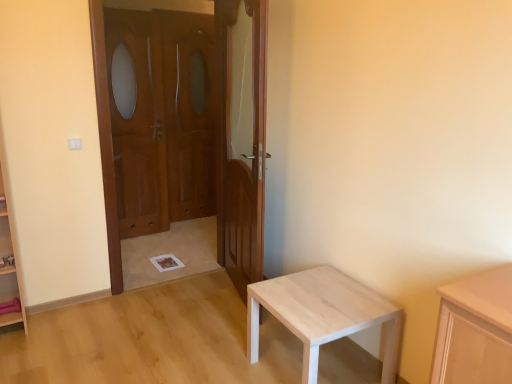
Where is `wooden screen door at center, the 1th screen door in the left-to-right sequence`? The height and width of the screenshot is (384, 512). wooden screen door at center, the 1th screen door in the left-to-right sequence is located at coordinates (136, 123).

What do you see at coordinates (323, 314) in the screenshot? The width and height of the screenshot is (512, 384). I see `light wood table at lower right` at bounding box center [323, 314].

You are a GUI agent. You are given a task and a screenshot of the screen. Output one action in this format:
    pyautogui.click(x=<x>, y=<y>)
    Task: Click on the wooden screen door at center, the 1th screen door in the left-to-right sequence
    
    Given the screenshot: What is the action you would take?
    pyautogui.click(x=136, y=123)

Looking at this image, is wooden screen door at center, the 1th screen door in the left-to-right sequence, surrounding wooden screen door at center, the 1th screen door in the right-to-left sequence?

No.

Based on the photo, can you confirm if wooden screen door at center, the 1th screen door in the left-to-right sequence, is wider than wooden screen door at center, the second screen door positioned from the left?

Yes.

Is wooden screen door at center, the 1th screen door in the left-to-right sequence, far from wooden screen door at center, the second screen door positioned from the left?

No, wooden screen door at center, the 1th screen door in the left-to-right sequence, is not far from wooden screen door at center, the second screen door positioned from the left.

Is wooden screen door at center, which is the second screen door from right to left, closer to the viewer compared to wooden screen door at center, the second screen door positioned from the left?

That is True.

Is wooden door at left, which ranks as the first door in left-to-right order, turned away from wooden screen door at center, the 1th screen door in the left-to-right sequence?

Yes.

In the scene shown: Which object is thinner, wooden door at left, placed as the second door when sorted from right to left, or wooden screen door at center, which is the second screen door from right to left?

Thinner between the two is wooden screen door at center, which is the second screen door from right to left.

From the image's perspective, is wooden door at left, which ranks as the first door in left-to-right order, under wooden screen door at center, which is the second screen door from right to left?

Yes.

Which point is more distant from viewer, (229,212) or (127,194)?

The point (127,194) is farther from the camera.

Find the location of a particular element. Image resolution: width=512 pixels, height=384 pixels. table below the wooden screen door at center, the 1th screen door in the left-to-right sequence (from a real-world perspective) is located at coordinates (323, 314).

Which is less distant, (140, 112) or (318, 293)?

The point (318, 293) is closer to the camera.

Is light wood table at lower right a part of wooden screen door at center, which is the second screen door from right to left?

No, light wood table at lower right is not inside wooden screen door at center, which is the second screen door from right to left.

From the image's perspective, is wooden screen door at center, the 1th screen door in the left-to-right sequence, positioned above or below light wood table at lower right?

wooden screen door at center, the 1th screen door in the left-to-right sequence, is above light wood table at lower right.

Does light wood table at lower right have a greater width compared to wooden screen door at center, the second screen door positioned from the left?

Correct, the width of light wood table at lower right exceeds that of wooden screen door at center, the second screen door positioned from the left.

Measure the distance from light wood table at lower right to wooden screen door at center, the second screen door positioned from the left.

The distance of light wood table at lower right from wooden screen door at center, the second screen door positioned from the left, is 2.55 meters.

Is light wood table at lower right closer to camera compared to wooden screen door at center, the second screen door positioned from the left?

Yes, it is.

From a real-world perspective, is light wood table at lower right below wooden screen door at center, the 1th screen door in the right-to-left sequence?

Yes, from a real-world perspective, light wood table at lower right is below wooden screen door at center, the 1th screen door in the right-to-left sequence.

Does wooden at center, placed as the 2th door when sorted from left to right, have a larger size compared to wooden door at left, placed as the second door when sorted from right to left?

Yes, wooden at center, placed as the 2th door when sorted from left to right, is bigger than wooden door at left, placed as the second door when sorted from right to left.

Would you say wooden at center, which is the 1th door in right-to-left order, is to the left or to the right of wooden door at left, placed as the second door when sorted from right to left, in the picture?

Clearly, wooden at center, which is the 1th door in right-to-left order, is on the right of wooden door at left, placed as the second door when sorted from right to left, in the image.

Is wooden at center, which is the 1th door in right-to-left order, not near wooden door at left, placed as the second door when sorted from right to left?

Yes.

Which is farther from the camera, (147, 180) or (236, 240)?

The point (147, 180) is behind.

I want to click on the 1st screen door behind when counting from the wooden door at left, placed as the second door when sorted from right to left, so click(x=136, y=123).

From the image's perspective, is wooden screen door at center, the 1th screen door in the left-to-right sequence, located beneath wooden door at left, which ranks as the first door in left-to-right order?

Incorrect, from the image's perspective, wooden screen door at center, the 1th screen door in the left-to-right sequence, is higher than wooden door at left, which ranks as the first door in left-to-right order.

Which is more to the right, wooden screen door at center, which is the second screen door from right to left, or wooden door at left, placed as the second door when sorted from right to left?

From the viewer's perspective, wooden door at left, placed as the second door when sorted from right to left, appears more on the right side.

Based on the photo, is wooden door at left, placed as the second door when sorted from right to left, to the right of light wood table at lower right from the viewer's perspective?

In fact, wooden door at left, placed as the second door when sorted from right to left, is to the left of light wood table at lower right.

Which is less distant, (210, 192) or (249, 328)?

Point (210, 192).

Would you consider wooden door at left, which ranks as the first door in left-to-right order, to be distant from light wood table at lower right?

Yes, wooden door at left, which ranks as the first door in left-to-right order, is far from light wood table at lower right.

Considering the sizes of wooden door at left, which ranks as the first door in left-to-right order, and light wood table at lower right in the image, is wooden door at left, which ranks as the first door in left-to-right order, taller or shorter than light wood table at lower right?

Clearly, wooden door at left, which ranks as the first door in left-to-right order, is taller compared to light wood table at lower right.

This screenshot has height=384, width=512. In order to click on screen door located above the wooden screen door at center, the 1th screen door in the left-to-right sequence (from the image's perspective) in this screenshot , I will do `click(189, 112)`.

Locate an element on the screen. This screenshot has width=512, height=384. the 1st door in front of the wooden screen door at center, the 1th screen door in the left-to-right sequence, counting from the anchor's position is located at coordinates (230, 144).

Which object lies further to the anchor point light wood table at lower right, wooden door at left, placed as the second door when sorted from right to left, or wooden screen door at center, the second screen door positioned from the left?

wooden screen door at center, the second screen door positioned from the left, is positioned further to the anchor light wood table at lower right.

When comparing their distances from wooden at center, which is the 1th door in right-to-left order, does light wood table at lower right or wooden door at left, placed as the second door when sorted from right to left, seem closer?

light wood table at lower right is positioned closer to the anchor wooden at center, which is the 1th door in right-to-left order.

Estimate the real-world distances between objects in this image. Which object is closer to light wood table at lower right, wooden at center, placed as the 2th door when sorted from left to right, or wooden door at left, placed as the second door when sorted from right to left?

Among the two, wooden at center, placed as the 2th door when sorted from left to right, is located nearer to light wood table at lower right.

Which object lies nearer to the anchor point light wood table at lower right, wooden screen door at center, which is the second screen door from right to left, or wooden screen door at center, the 1th screen door in the right-to-left sequence?

wooden screen door at center, which is the second screen door from right to left, is positioned closer to the anchor light wood table at lower right.

Based on their spatial positions, is wooden screen door at center, the 1th screen door in the right-to-left sequence, or wooden door at left, placed as the second door when sorted from right to left, closer to light wood table at lower right?

wooden door at left, placed as the second door when sorted from right to left, is positioned closer to the anchor light wood table at lower right.

Which object lies nearer to the anchor point wooden screen door at center, the 1th screen door in the right-to-left sequence, wooden screen door at center, the 1th screen door in the left-to-right sequence, or light wood table at lower right?

Among the two, wooden screen door at center, the 1th screen door in the left-to-right sequence, is located nearer to wooden screen door at center, the 1th screen door in the right-to-left sequence.

Looking at the image, which one is located closer to wooden screen door at center, which is the second screen door from right to left, wooden screen door at center, the second screen door positioned from the left, or wooden door at left, which ranks as the first door in left-to-right order?

wooden door at left, which ranks as the first door in left-to-right order.

Based on their spatial positions, is wooden door at left, placed as the second door when sorted from right to left, or wooden at center, placed as the 2th door when sorted from left to right, closer to light wood table at lower right?

wooden at center, placed as the 2th door when sorted from left to right.

What are the coordinates of `door between wooden door at left, which ranks as the first door in left-to-right order, and light wood table at lower right from top to bottom` in the screenshot? It's located at (243, 155).

Where is `door positioned between wooden at center, placed as the 2th door when sorted from left to right, and wooden screen door at center, the 1th screen door in the left-to-right sequence, from near to far`? The height and width of the screenshot is (384, 512). door positioned between wooden at center, placed as the 2th door when sorted from left to right, and wooden screen door at center, the 1th screen door in the left-to-right sequence, from near to far is located at coordinates (230, 144).

Identify the location of screen door positioned between wooden at center, placed as the 2th door when sorted from left to right, and wooden screen door at center, the 1th screen door in the right-to-left sequence, from near to far. The width and height of the screenshot is (512, 384). (136, 123).

The image size is (512, 384). What are the coordinates of `screen door positioned between wooden door at left, placed as the second door when sorted from right to left, and wooden screen door at center, the second screen door positioned from the left, from near to far` in the screenshot? It's located at (136, 123).